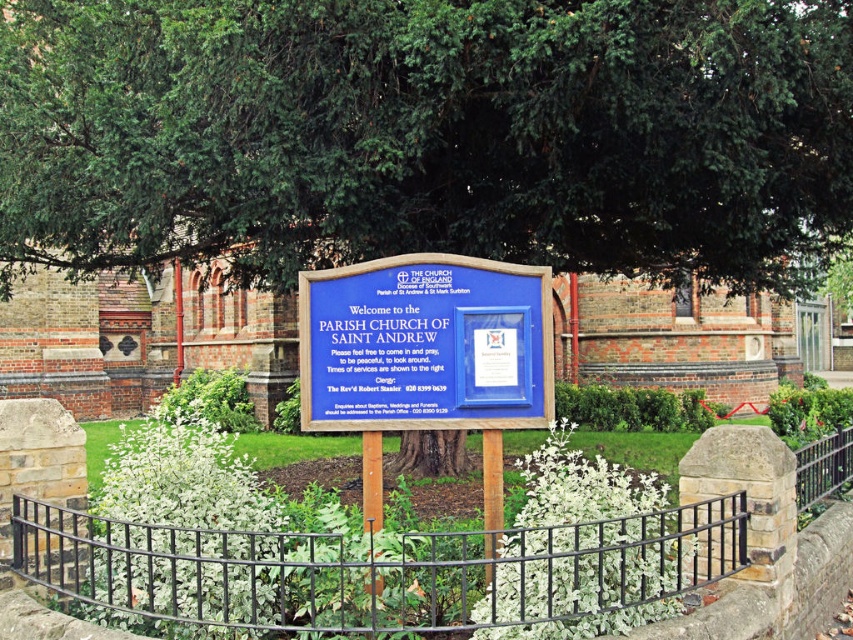
Question: Which point is closer to the camera taking this photo?

Choices:
 (A) (486, 301)
 (B) (258, 625)

Answer: (B)

Question: Is green leafy tree at upper center thinner than black metal fence at center?

Choices:
 (A) yes
 (B) no

Answer: (A)

Question: Is the position of green leafy tree at upper center less distant than that of blue wooden sign at center?

Choices:
 (A) no
 (B) yes

Answer: (A)

Question: Which object is closer to the camera taking this photo?

Choices:
 (A) black metal fence at center
 (B) green leafy tree at upper center
 (C) blue wooden sign at center

Answer: (A)

Question: Is black metal fence at center smaller than blue wooden sign at center?

Choices:
 (A) no
 (B) yes

Answer: (A)

Question: Which object is the farthest from the green leafy tree at upper center?

Choices:
 (A) blue wooden sign at center
 (B) black metal fence at center

Answer: (B)